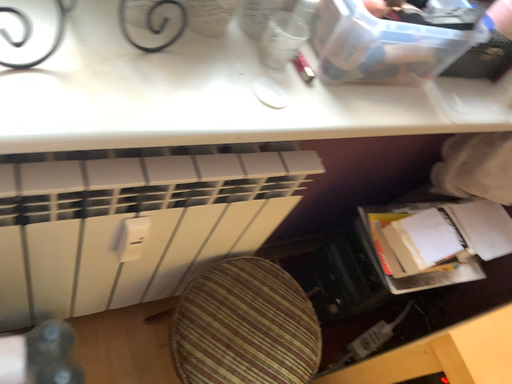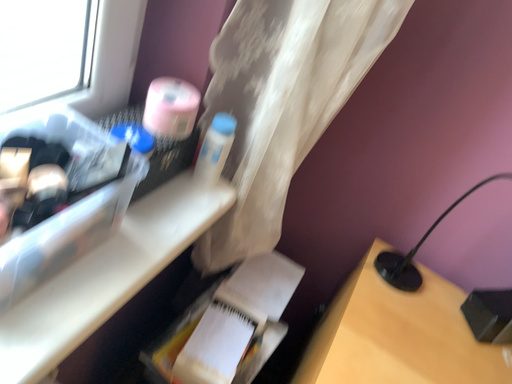
Question: Which way did the camera rotate in the video?

Choices:
 (A) rotated left
 (B) rotated right

Answer: (B)